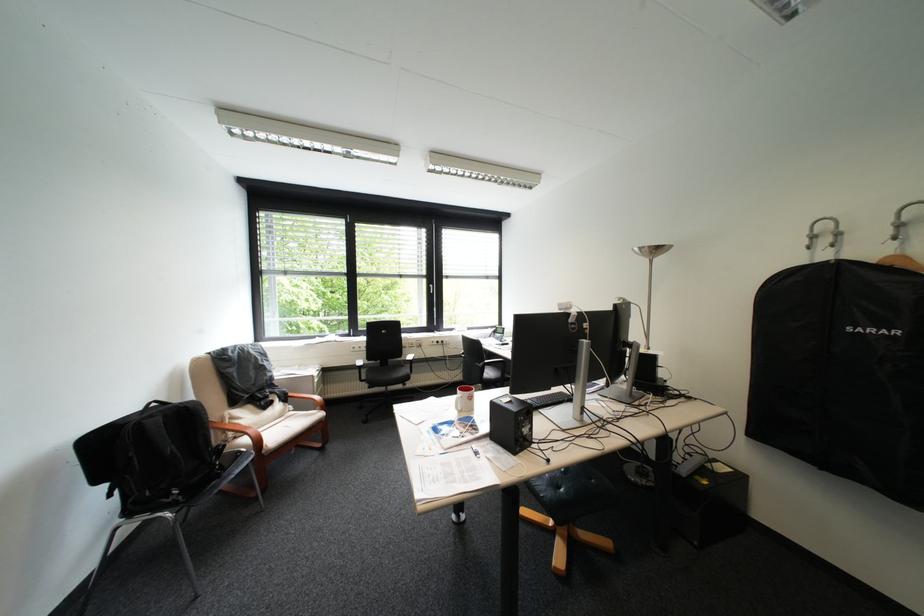
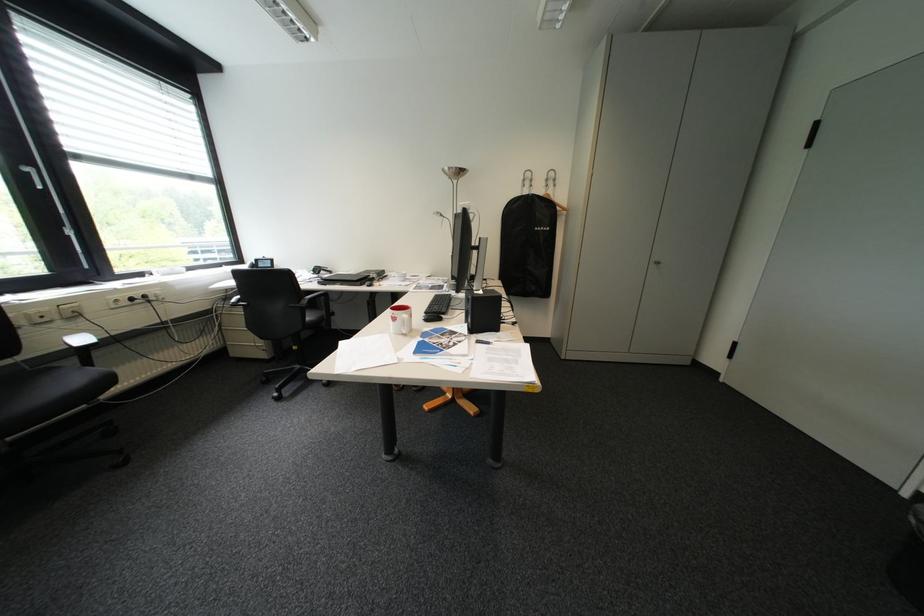
Find the pixel in the second image that matches pixel 507 437 in the first image.

(484, 331)